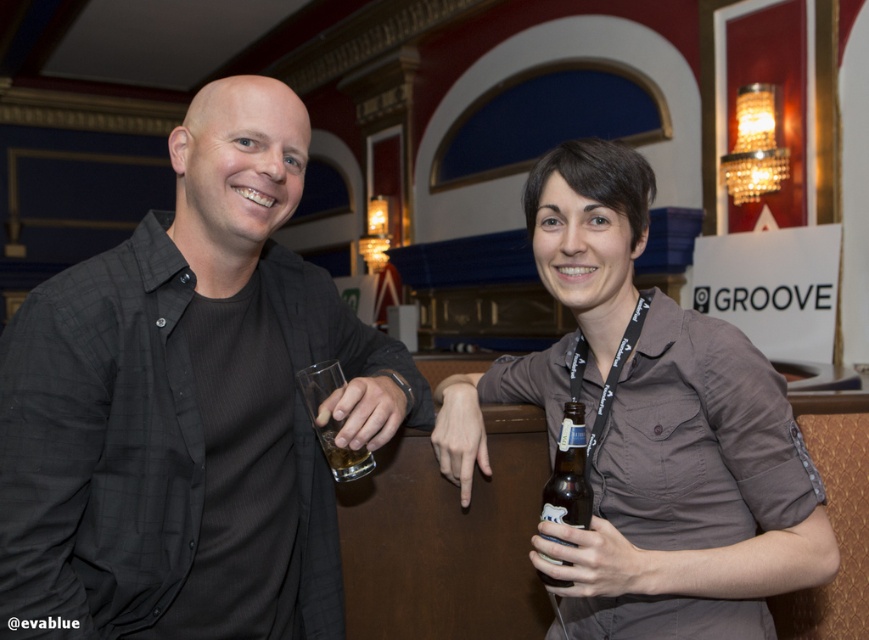
You are at a social event and want to grab a drink. You see a brown glass bottle at lower center and a translucent glass at hand left. Which one is physically nearer to you?

The brown glass bottle at lower center is closer to the viewer than the translucent glass at hand left, so the brown glass bottle at lower center is physically nearer to you.

You are at a social event and want to grab a drink. There are two drinks available here. The brown glass bottle at lower center and the translucent glass at hand left. Which one is closer to your right hand?

The brown glass bottle at lower center is to the right of the translucent glass at hand left, so the brown glass bottle at lower center is closer to your right hand.